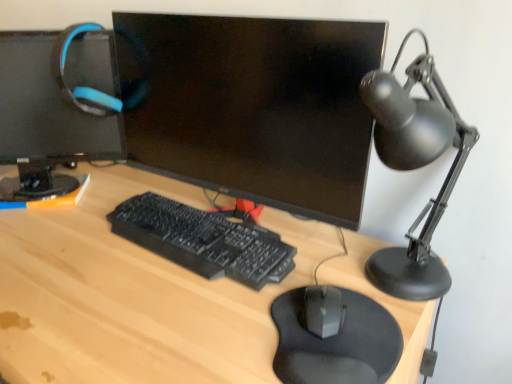
At what (x,y) coordinates should I click in order to perform the action: click on free space that is to the left of black plastic keyboard at center. Please return your answer as a coordinate pair (x, y). The width and height of the screenshot is (512, 384). Looking at the image, I should click on (72, 253).